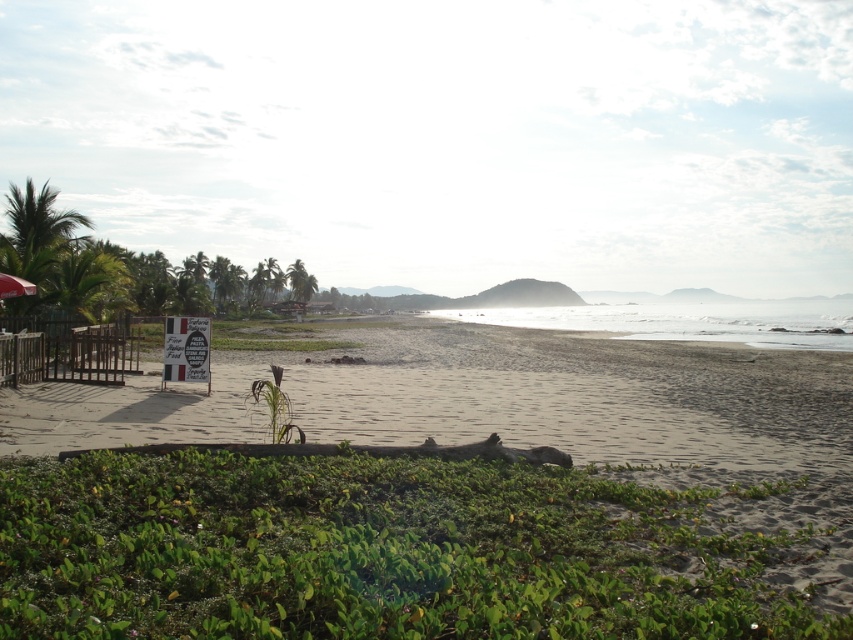
In the scene shown: You are standing at the beach and want to take a photo. There are two points marked on your map as point 1 at coordinates point (x=57, y=228) and point 2 at coordinates point (x=33, y=285). Which point is closer to your current position if you are facing the beach?

Point (x=57, y=228) is further to the camera than point (x=33, y=285), so if you are facing the beach, point (x=33, y=285) is closer to your current position because it is nearer to the camera position.

Based on the photo, you are standing at the center of the beach scene. Looking towards the lower center, can you tell me the exact coordinates where the green leafy vegetation at lower center is located?

The green leafy vegetation at lower center is located at coordinates point [380,552].

You are standing at the point marked by the coordinates point [380,552] in this beach scene. Looking around, you notice the wooden structure with a red umbrella to your left. Where is the green leafy vegetation located relative to your current position?

The point [380,552] marks the location of the green leafy vegetation at lower center, so you are currently standing directly on it.